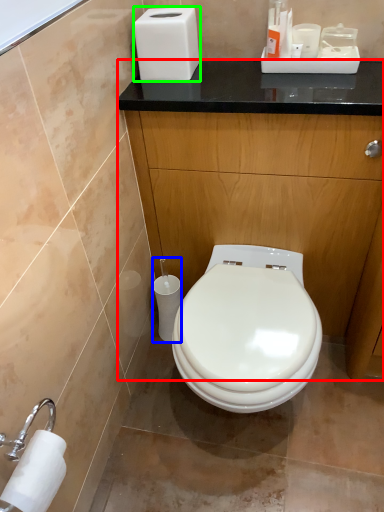
Question: Which object is the farthest from dresser (highlighted by a red box)? Choose among these: toilet paper (highlighted by a blue box) or hand dryer (highlighted by a green box).

Choices:
 (A) toilet paper
 (B) hand dryer

Answer: (A)